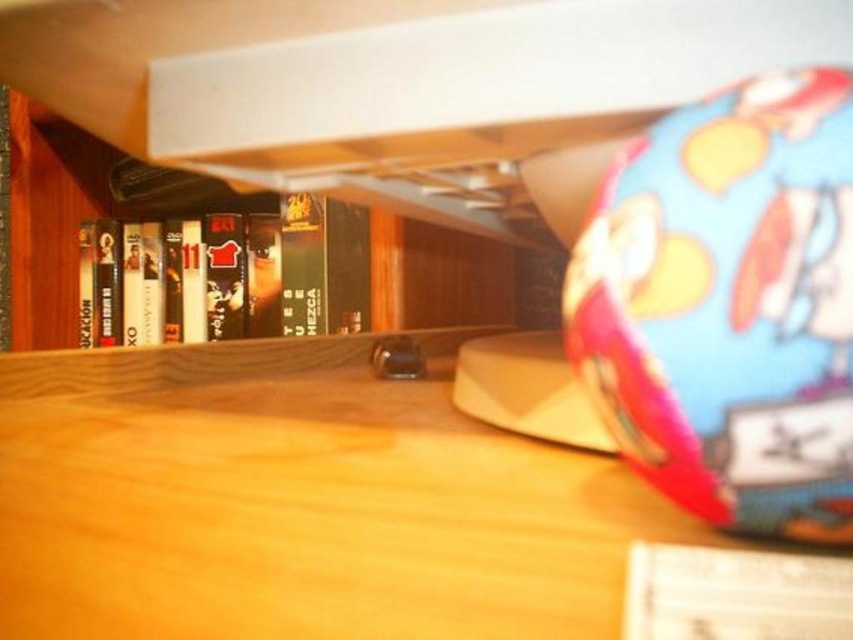
Question: Among these points, which one is farthest from the camera?

Choices:
 (A) (357, 300)
 (B) (404, 285)

Answer: (A)

Question: Is wooden table at center to the right of black matte book at center from the viewer's perspective?

Choices:
 (A) yes
 (B) no

Answer: (A)

Question: Is wooden table at center below black matte dvd case at center?

Choices:
 (A) yes
 (B) no

Answer: (A)

Question: Considering the real-world distances, which object is closest to the black matte dvd case at center?

Choices:
 (A) wooden table at center
 (B) black matte book at center

Answer: (B)

Question: Where is wooden table at center located in relation to black matte dvd case at center in the image?

Choices:
 (A) below
 (B) above

Answer: (A)

Question: Which of these objects is positioned farthest from the black matte book at center?

Choices:
 (A) wooden table at center
 (B) black matte dvd case at center

Answer: (A)